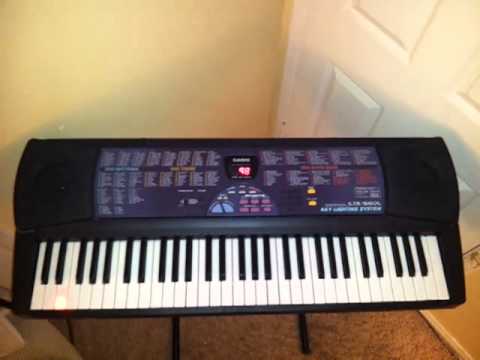
I want to click on chair, so click(26, 342).